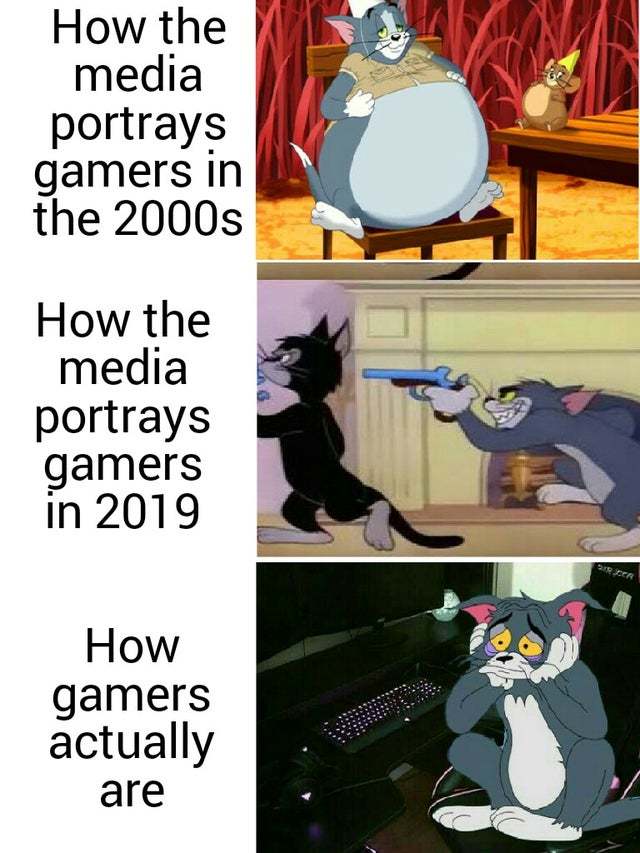
At what (x,y) coordinates should I click in order to perform the action: click on left table leg. Please return your answer as a coordinate pair (x, y). The height and width of the screenshot is (853, 640). Looking at the image, I should click on (525, 202).